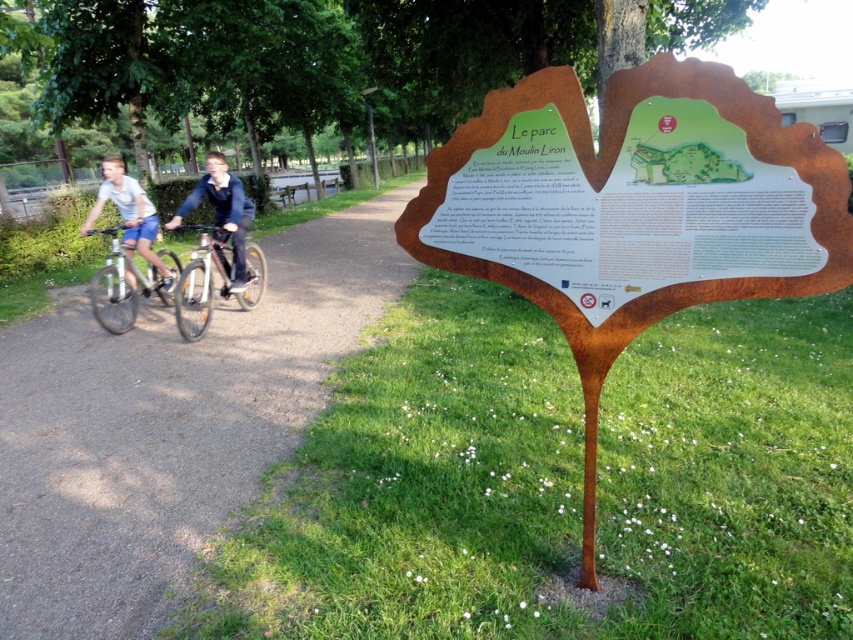
Which of these two, silver metallic bicycle at center or matte white shirt at left, stands shorter?

Standing shorter between the two is silver metallic bicycle at center.

Does silver metallic bicycle at center appear under matte white shirt at left?

Yes, silver metallic bicycle at center is below matte white shirt at left.

Who is more forward, (183, 300) or (138, 188)?

Point (183, 300) is more forward.

In order to click on silver metallic bicycle at center in this screenshot , I will do (x=212, y=282).

Can you confirm if gravel path at center is shorter than silver metallic bicycle at center?

Incorrect, gravel path at center's height does not fall short of silver metallic bicycle at center's.

Which is below, gravel path at center or silver metallic bicycle at center?

gravel path at center is lower down.

Where is `gravel path at center`? gravel path at center is located at coordinates (167, 424).

Where is `gravel path at center`? gravel path at center is located at coordinates (167, 424).

Is point (262, 273) positioned after point (221, 227)?

Yes, point (262, 273) is behind point (221, 227).

Is matte white bicycles at left to the left of blue denim jacket at center from the viewer's perspective?

Incorrect, matte white bicycles at left is not on the left side of blue denim jacket at center.

Which is behind, point (96, 314) or point (236, 259)?

Point (236, 259)

At what (x,y) coordinates should I click in order to perform the action: click on matte white bicycles at left. Please return your answer as a coordinate pair (x, y). Looking at the image, I should click on (218, 250).